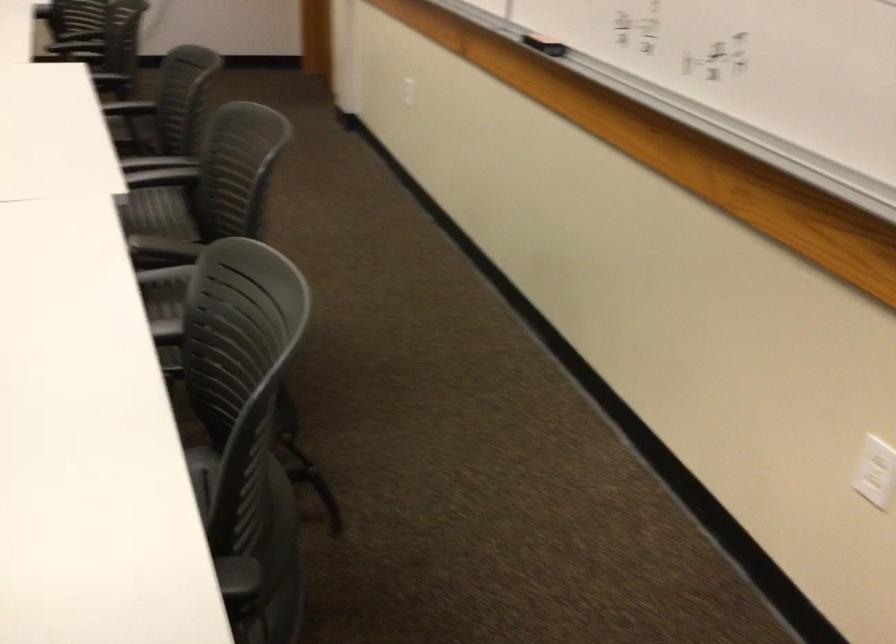
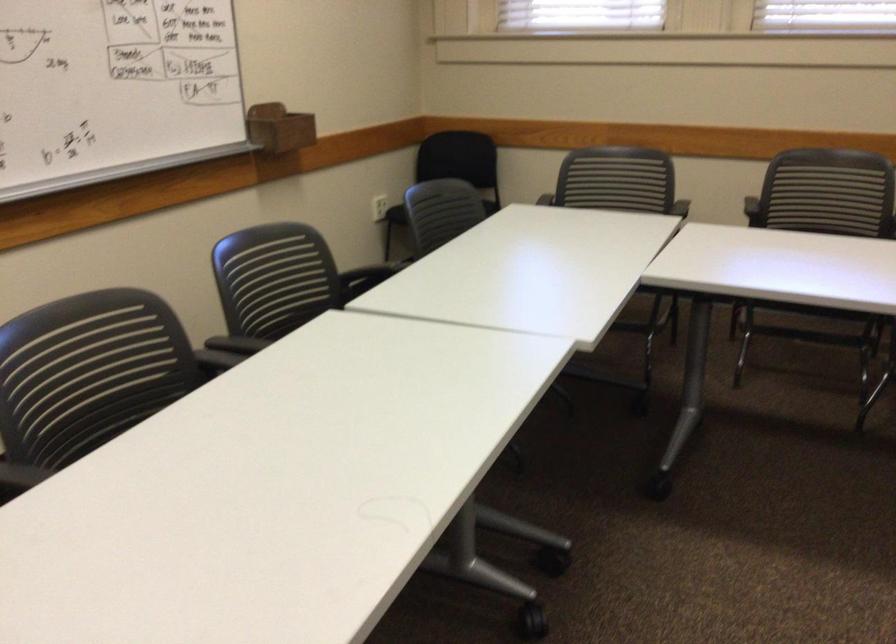
Where in the second image is the point corresponding to the point at 197,138 from the first image?

(125, 375)